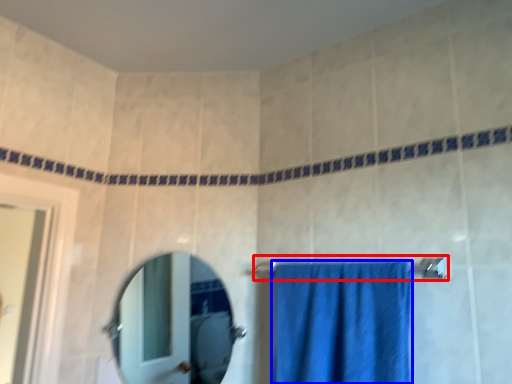
Question: Which point is closer to the camera, towel bar (highlighted by a red box) or towel (highlighted by a blue box)?

Choices:
 (A) towel bar
 (B) towel

Answer: (B)